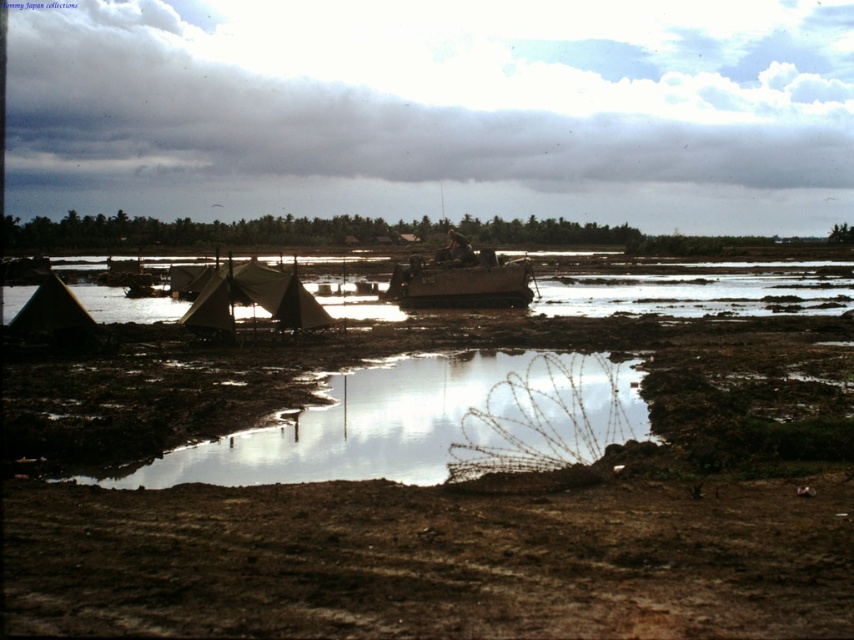
Question: Which point appears farthest from the camera in this image?

Choices:
 (A) tap(235, 273)
 (B) tap(419, 292)

Answer: (B)

Question: Based on their relative distances, which object is nearer to the brown canvas tent at center?

Choices:
 (A) matte brown tent at lower left
 (B) brown matte boat at center

Answer: (A)

Question: Is brown muddy water at center positioned before brown canvas tent at center?

Choices:
 (A) no
 (B) yes

Answer: (A)

Question: Is reflective mud puddle at center thinner than matte brown tent at lower left?

Choices:
 (A) yes
 (B) no

Answer: (A)

Question: Can you confirm if reflective mud puddle at center is smaller than brown canvas tent at center?

Choices:
 (A) yes
 (B) no

Answer: (A)

Question: Which point is farther to the camera?

Choices:
 (A) matte brown tent at lower left
 (B) brown canvas tent at center

Answer: (B)